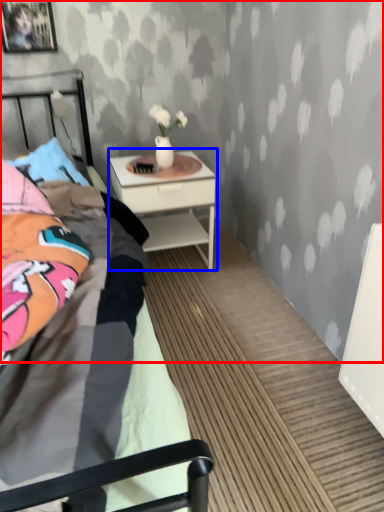
Question: Which object appears closest to the camera in this image, backdrop (highlighted by a red box) or nightstand (highlighted by a blue box)?

Choices:
 (A) backdrop
 (B) nightstand

Answer: (A)